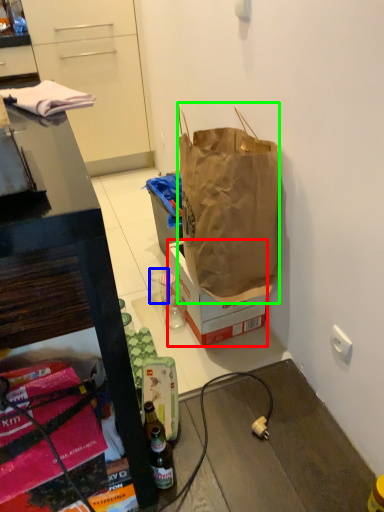
Question: Based on their relative distances, which object is nearer to box (highlighted by a red box)? Choose from coffee cup (highlighted by a blue box) and handbag (highlighted by a green box).

Choices:
 (A) coffee cup
 (B) handbag

Answer: (B)